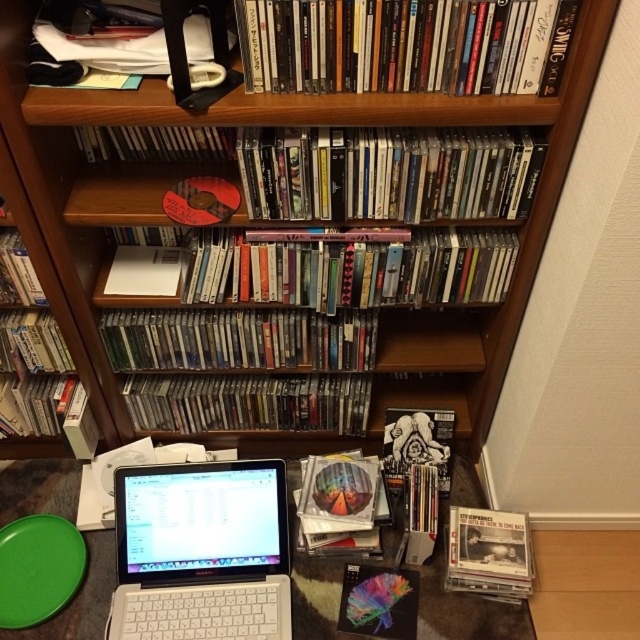
Can you confirm if wooden bookcase at upper center is shorter than white plastic table at lower center?

Incorrect, wooden bookcase at upper center's height does not fall short of white plastic table at lower center's.

Is the position of wooden bookcase at upper center less distant than that of white plastic table at lower center?

That is True.

At what (x,y) coordinates should I click in order to perform the action: click on wooden bookcase at upper center. Please return your answer as a coordinate pair (x, y). The image size is (640, 640). Looking at the image, I should click on (237, 180).

Does point (422, 52) lie behind point (189, 212)?

No, it is in front of (189, 212).

Is matte plastic books at upper center wider than matte brown cd at upper center?

Correct, the width of matte plastic books at upper center exceeds that of matte brown cd at upper center.

Is point (314, 49) closer to camera compared to point (220, 218)?

Yes, it is in front of point (220, 218).

The height and width of the screenshot is (640, 640). What are the coordinates of `matte plastic books at upper center` in the screenshot? It's located at (404, 44).

The width and height of the screenshot is (640, 640). Describe the element at coordinates (237, 180) in the screenshot. I see `wooden bookcase at upper center` at that location.

Is point (108, 422) positioned behind point (337, 147)?

Yes, it is.

Identify the location of wooden bookcase at upper center. The width and height of the screenshot is (640, 640). (237, 180).

Where is `wooden bookcase at upper center`? wooden bookcase at upper center is located at coordinates (237, 180).